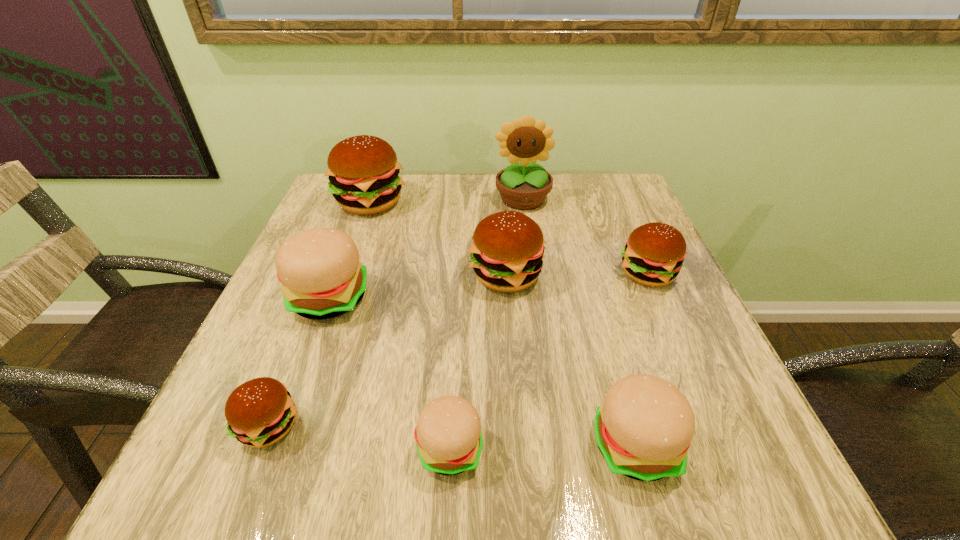
Locate an element on the screen. This screenshot has height=540, width=960. object that is the fourth nearest to the third smallest brown hamburger is located at coordinates (363, 170).

This screenshot has height=540, width=960. I want to click on object that is the sixth closest to the third brown hamburger from left to right, so click(448, 434).

Select which hamburger appears as the fifth closest to the farthest beige hamburger. Please provide its 2D coordinates. Your answer should be formatted as a tuple, i.e. [(x, y)], where the tuple contains the x and y coordinates of a point satisfying the conditions above.

[(643, 429)]

This screenshot has width=960, height=540. I want to click on hamburger that can be found as the fifth closest to the second hamburger from right to left, so click(260, 412).

At what (x,y) coordinates should I click in order to perform the action: click on the second closest brown hamburger to the second smallest brown hamburger. Please return your answer as a coordinate pair (x, y). The height and width of the screenshot is (540, 960). Looking at the image, I should click on (363, 170).

Select which brown hamburger is the second closest to the second biggest beige hamburger. Please provide its 2D coordinates. Your answer should be formatted as a tuple, i.e. [(x, y)], where the tuple contains the x and y coordinates of a point satisfying the conditions above.

[(653, 256)]

Choose which beige hamburger is the second nearest neighbor to the second biggest brown hamburger. Please provide its 2D coordinates. Your answer should be formatted as a tuple, i.e. [(x, y)], where the tuple contains the x and y coordinates of a point satisfying the conditions above.

[(643, 429)]

At what (x,y) coordinates should I click in order to perform the action: click on the third closest beige hamburger to the seventh shortest object. Please return your answer as a coordinate pair (x, y). Image resolution: width=960 pixels, height=540 pixels. Looking at the image, I should click on (643, 429).

Find the location of `vacant space that satisfies the following two spatial constraints: 1. on the back side of the second beige hamburger from right to left; 2. on the right side of the second biggest brown hamburger`. vacant space that satisfies the following two spatial constraints: 1. on the back side of the second beige hamburger from right to left; 2. on the right side of the second biggest brown hamburger is located at coordinates (460, 275).

The height and width of the screenshot is (540, 960). I want to click on vacant space that satisfies the following two spatial constraints: 1. on the front side of the rightmost brown hamburger; 2. on the right side of the tallest hamburger, so click(344, 273).